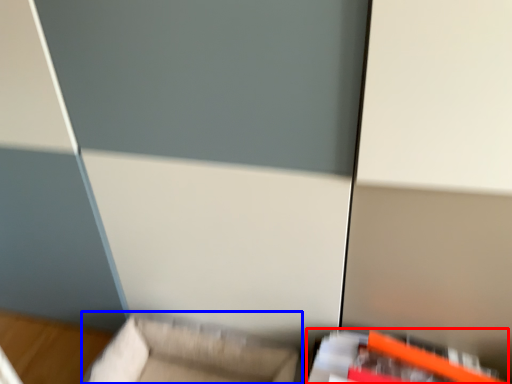
Question: Which of the following is the farthest to the observer, furniture (highlighted by a red box) or furniture (highlighted by a blue box)?

Choices:
 (A) furniture
 (B) furniture

Answer: (B)